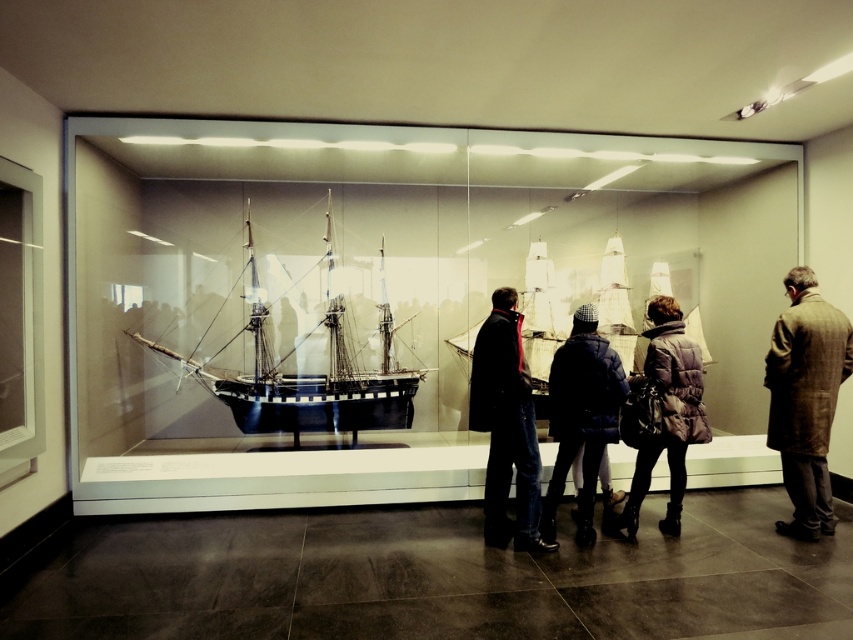
You are a security guard in the museum and want to ensure the dark blue quilted jacket at center is not blocking the view of the ship model. Based on its position at point [581,417], is the jacket likely obstructing the display case?

The dark blue quilted jacket at center is located at point [581,417], which is directly in front of the display case, so it is likely obstructing the view of the ship model.

You are a security guard in the museum and need to determine if the brown wool coat at right can be placed on a shelf that is exactly the same height as the black polished wood ship at center. Can it fit without exceeding the shelf height?

The black polished wood ship at center is taller than the brown wool coat at right. Since the shelf height matches the ship, the brown wool coat at right will fit without exceeding the shelf height.

You are a museum visitor who wants to take a photo of the black polished wood ship at center and the brown wool coat at right. Since the display case has a glass surface, you need to ensure you are not blocking the view. If you stand to the left of the display case, will both objects be visible in your photo?

The black polished wood ship at center is to the left of the brown wool coat at right. If you stand to the left of the display case, you can see both objects as the ship is positioned to the left side of the coat, so they should be visible in the frame when photographed from that angle.